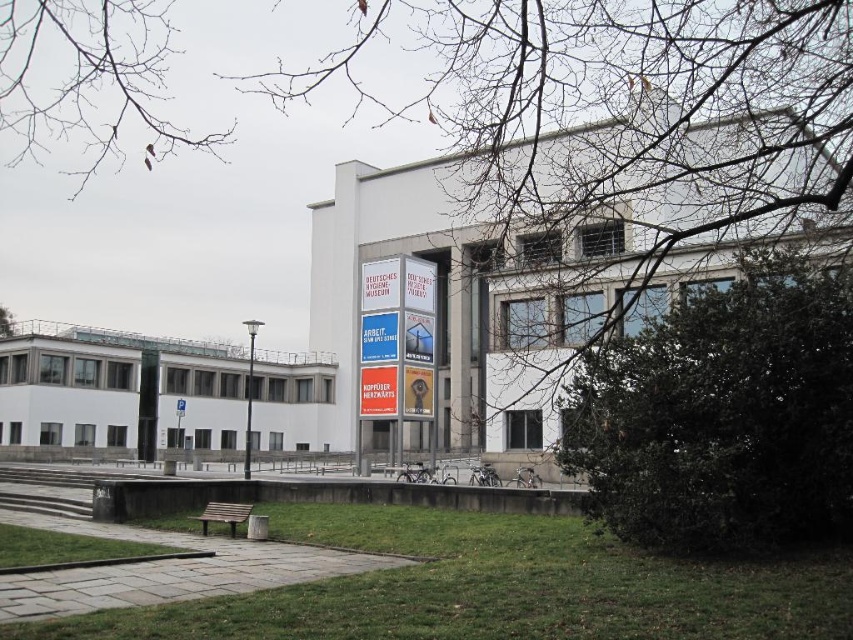
Question: Does green leafy tree at center have a lesser width compared to bare branches at upper left?

Choices:
 (A) yes
 (B) no

Answer: (A)

Question: Among these points, which one is farthest from the camera?

Choices:
 (A) (370, 289)
 (B) (468, 65)
 (C) (10, 332)

Answer: (C)

Question: Estimate the real-world distances between objects in this image. Which object is closer to the white paper sign at center?

Choices:
 (A) green leafy tree at upper left
 (B) green leafy tree at center
 (C) dark green leafy bush at center right
 (D) bare branches at upper left

Answer: (B)

Question: Can you confirm if white paper sign at center is bigger than green leafy tree at upper left?

Choices:
 (A) no
 (B) yes

Answer: (A)

Question: Does green leafy tree at center appear on the right side of green leafy tree at upper left?

Choices:
 (A) no
 (B) yes

Answer: (B)

Question: Which point is closer to the camera?

Choices:
 (A) white paper sign at center
 (B) dark green leafy bush at center right
 (C) green leafy tree at upper left
 (D) bare branches at upper left

Answer: (B)